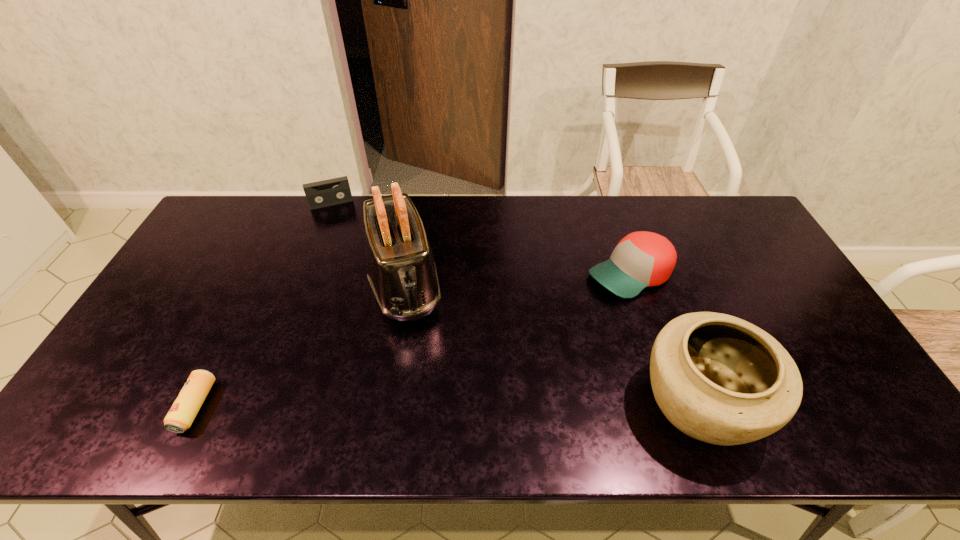
At what (x,y) coordinates should I click in order to perform the action: click on vacant space located 0.070m on the front-facing side of the second shortest object. Please return your answer as a coordinate pair (x, y). This screenshot has height=540, width=960. Looking at the image, I should click on (340, 221).

Find the location of a particular element. The height and width of the screenshot is (540, 960). free space located on the front-facing side of the second shortest object is located at coordinates (347, 251).

You are a GUI agent. You are given a task and a screenshot of the screen. Output one action in this format:
    pyautogui.click(x=<x>, y=<y>)
    Task: Click on the vacant region located 0.080m on the front-facing side of the second shortest object
    The width and height of the screenshot is (960, 540).
    Given the screenshot: What is the action you would take?
    pyautogui.click(x=340, y=223)

Identify the location of blank area located 0.050m on the side of the tallest object with the control lever. The image size is (960, 540). (415, 342).

Locate an element on the screen. This screenshot has width=960, height=540. free point located 0.070m on the side of the tallest object with the control lever is located at coordinates (417, 348).

Image resolution: width=960 pixels, height=540 pixels. What are the coordinates of `free space located 0.100m on the side of the tallest object with the control lever` in the screenshot? It's located at (420, 357).

The height and width of the screenshot is (540, 960). Identify the location of vacant region located at the brim of the baseball cap. (573, 304).

The width and height of the screenshot is (960, 540). In order to click on free spot located at the brim of the baseball cap in this screenshot , I will do `click(520, 334)`.

At what (x,y) coordinates should I click in order to perform the action: click on free location located 0.070m at the brim of the baseball cap. Please return your answer as a coordinate pair (x, y). Looking at the image, I should click on (581, 300).

Locate an element on the screen. This screenshot has width=960, height=540. object located in the far edge section of the desktop is located at coordinates (319, 194).